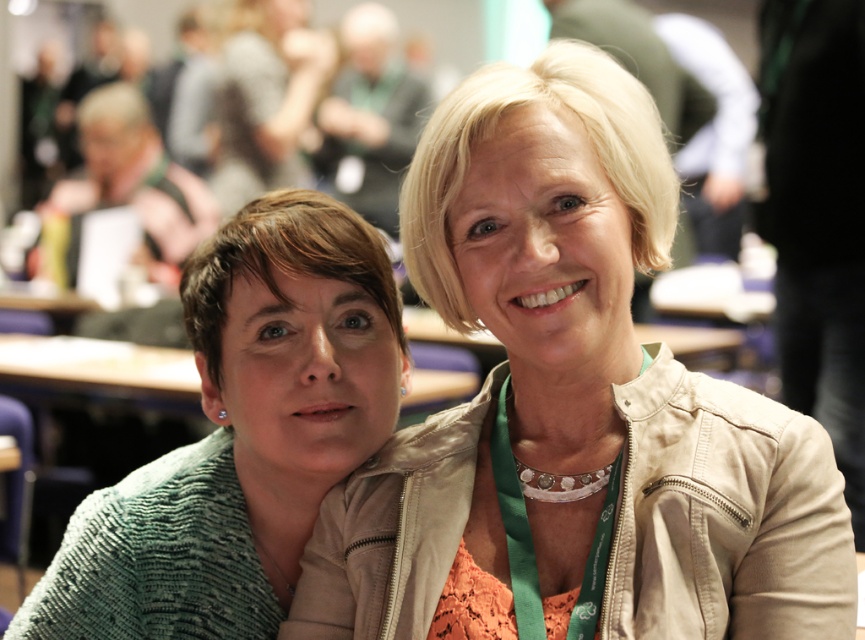
Consider the image. You are organizing a coat rack in a small room. You have a beige leather jacket at upper center and a green knitted sweater at left. Which item should you hang first if you want to ensure both can fit on the rack without overlapping?

The beige leather jacket at upper center is wider than the green knitted sweater at left, so you should hang the beige leather jacket at upper center first to accommodate its width and prevent overlapping.

You are a tailor measuring the distance between two clothing items in the image. The beige leather jacket at upper center is part of a display rack, and the green knitted sweater at left is hanging on a separate rack. Can you fit a third rack between them if the third rack requires 30 centimeters of space?

The distance between the beige leather jacket at upper center and the green knitted sweater at left is 26.94 centimeters. Since the required space for the third rack is 30 centimeters, which is wider than the existing gap, you cannot fit the third rack between them.

You are an interior designer assessing the seating arrangement in the image. You need to determine if the beige leather jacket at upper center and the green knitted sweater at left can both fit on a shelf that is 1.2 meters tall. Can they both fit?

The beige leather jacket at upper center is taller than the green knitted sweater at left. However, without knowing the exact height of the taller jacket, it is impossible to confirm if both can fit on the 1.2 meter shelf.